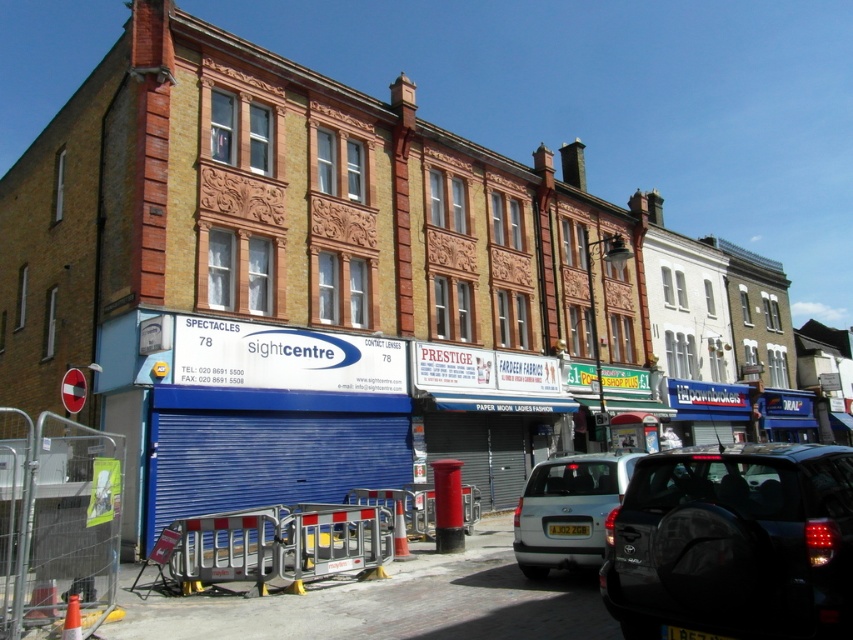
Question: Which object is the closest to the metallic silver barricade at lower center?

Choices:
 (A) silver metallic car at center
 (B) dark gray matte suv at lower right

Answer: (A)

Question: Is metallic silver barricade at lower center above silver metallic car at center?

Choices:
 (A) yes
 (B) no

Answer: (A)

Question: Which object is closer to the camera taking this photo?

Choices:
 (A) metallic silver barricade at lower center
 (B) dark gray matte suv at lower right

Answer: (B)

Question: Considering the relative positions of dark gray matte suv at lower right and metallic silver barricade at lower center in the image provided, where is dark gray matte suv at lower right located with respect to metallic silver barricade at lower center?

Choices:
 (A) below
 (B) above

Answer: (B)

Question: Where is dark gray matte suv at lower right located in relation to silver metallic car at center in the image?

Choices:
 (A) above
 (B) below

Answer: (A)

Question: Which object appears closest to the camera in this image?

Choices:
 (A) dark gray matte suv at lower right
 (B) metallic silver barricade at lower center
 (C) silver metallic car at center

Answer: (A)